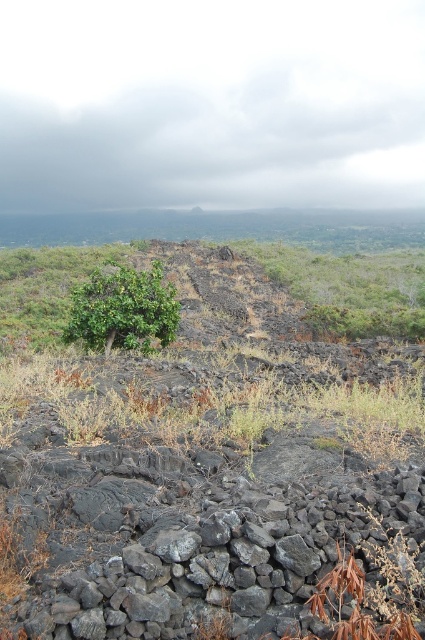
Is dull gray rock at center to the right of green leafy shrub at center from the viewer's perspective?

Yes, dull gray rock at center is to the right of green leafy shrub at center.

Who is positioned more to the left, dull gray rock at center or green leafy shrub at center?

Positioned to the left is green leafy shrub at center.

I want to click on dull gray rock at center, so click(198, 460).